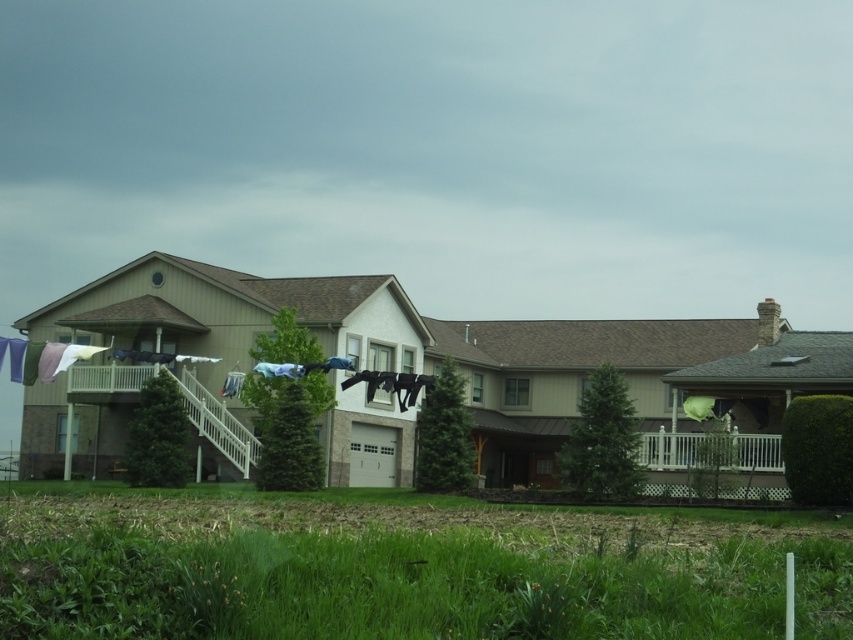
Does green grass at lower center appear on the left side of white wooden porch at right?

Correct, you'll find green grass at lower center to the left of white wooden porch at right.

Which is above, green grass at lower center or white wooden porch at right?

Positioned higher is white wooden porch at right.

Which is behind, point (166, 532) or point (776, 451)?

The point (776, 451) is behind.

The height and width of the screenshot is (640, 853). I want to click on green grass at lower center, so click(x=404, y=566).